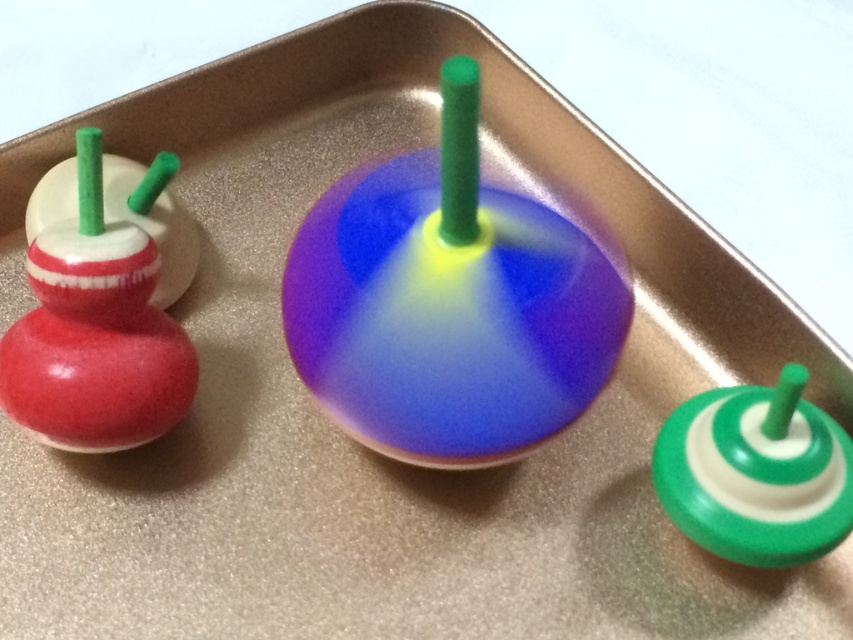
Is shiny plastic spinning top at center positioned before green rubber spinner at lower right?

Yes, it is.

Can you confirm if shiny plastic spinning top at center is smaller than green rubber spinner at lower right?

Actually, shiny plastic spinning top at center might be larger than green rubber spinner at lower right.

Who is more forward, (437, 253) or (834, 436)?

Point (437, 253)

Identify the location of shiny plastic spinning top at center. Image resolution: width=853 pixels, height=640 pixels. (448, 304).

Measure the distance between matte red wooden toy at left and green rubber spinner at lower right.

72.94 centimeters

Is matte red wooden toy at left wider than green rubber spinner at lower right?

Correct, the width of matte red wooden toy at left exceeds that of green rubber spinner at lower right.

Which is behind, point (169, 356) or point (753, 465)?

Point (169, 356)

I want to click on matte red wooden toy at left, so click(x=97, y=326).

Is shiny plastic spinning top at center closer to camera compared to matte red wooden toy at left?

Yes.

What do you see at coordinates (448, 304) in the screenshot? I see `shiny plastic spinning top at center` at bounding box center [448, 304].

Describe the element at coordinates (448, 304) in the screenshot. I see `shiny plastic spinning top at center` at that location.

Find the location of a particular element. This screenshot has width=853, height=640. shiny plastic spinning top at center is located at coordinates (448, 304).